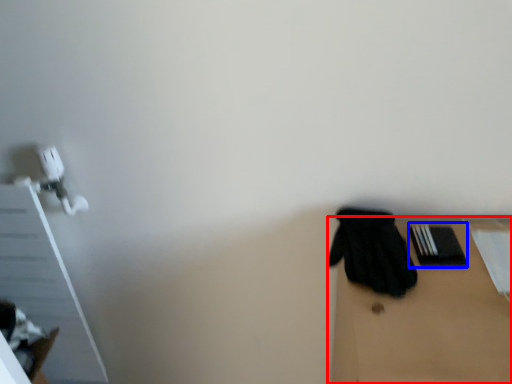
Question: Which of the following is the closest to the observer, table (highlighted by a red box) or bin (highlighted by a blue box)?

Choices:
 (A) table
 (B) bin

Answer: (A)